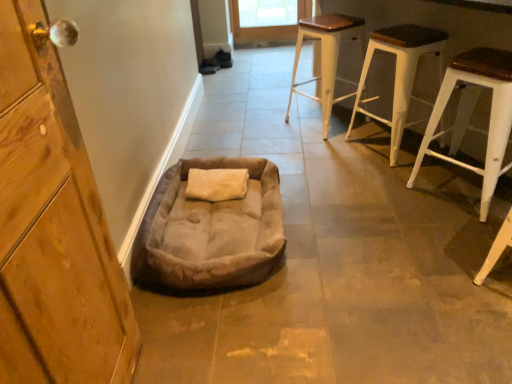
Question: Is suede-like beige dog bed at lower center to the right of white wood stool at right, which appears as the first stool when viewed from the right, from the viewer's perspective?

Choices:
 (A) yes
 (B) no

Answer: (B)

Question: From the image's perspective, is suede-like beige dog bed at lower center on top of white wood stool at right, which appears as the first stool when viewed from the right?

Choices:
 (A) yes
 (B) no

Answer: (B)

Question: Considering the relative sizes of suede-like beige dog bed at lower center and white wood stool at right, the 3th stool from the left, in the image provided, is suede-like beige dog bed at lower center smaller than white wood stool at right, the 3th stool from the left,?

Choices:
 (A) yes
 (B) no

Answer: (A)

Question: Does suede-like beige dog bed at lower center touch white wood stool at right, which appears as the first stool when viewed from the right?

Choices:
 (A) yes
 (B) no

Answer: (B)

Question: Is suede-like beige dog bed at lower center positioned far away from white wood stool at right, which appears as the first stool when viewed from the right?

Choices:
 (A) yes
 (B) no

Answer: (A)

Question: Does suede-like beige dog bed at lower center lie in front of white wood stool at right, which appears as the first stool when viewed from the right?

Choices:
 (A) yes
 (B) no

Answer: (A)

Question: Considering the relative sizes of white wood stool at right, which appears as the first stool when viewed from the right, and white wood stool at upper right, which ranks as the 2th stool in right-to-left order, in the image provided, is white wood stool at right, which appears as the first stool when viewed from the right, smaller than white wood stool at upper right, which ranks as the 2th stool in right-to-left order,?

Choices:
 (A) yes
 (B) no

Answer: (B)

Question: Is white wood stool at right, the 3th stool from the left, in contact with white wood stool at upper right, placed as the 2th stool when sorted from left to right?

Choices:
 (A) no
 (B) yes

Answer: (A)

Question: Is white wood stool at right, which appears as the first stool when viewed from the right, closer to the viewer compared to white wood stool at upper right, placed as the 2th stool when sorted from left to right?

Choices:
 (A) yes
 (B) no

Answer: (A)

Question: Does white wood stool at right, the 3th stool from the left, have a larger size compared to white wood stool at upper right, which ranks as the 2th stool in right-to-left order?

Choices:
 (A) no
 (B) yes

Answer: (B)

Question: From the image's perspective, does white wood stool at right, the 3th stool from the left, appear lower than white wood stool at upper right, placed as the 2th stool when sorted from left to right?

Choices:
 (A) yes
 (B) no

Answer: (A)

Question: From the image's perspective, is white wood stool at right, the 3th stool from the left, on top of white wood stool at upper right, placed as the 2th stool when sorted from left to right?

Choices:
 (A) yes
 (B) no

Answer: (B)

Question: Is white wood stool at upper right, which ranks as the 2th stool in right-to-left order, positioned behind suede-like beige dog bed at lower center?

Choices:
 (A) yes
 (B) no

Answer: (A)